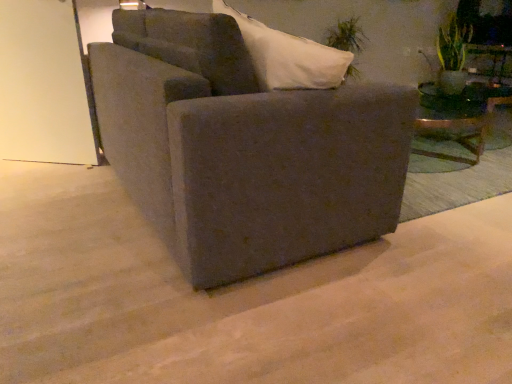
Where is `vacant space that is in between transparent glass door at upper left and matte gray couch at center`? The width and height of the screenshot is (512, 384). vacant space that is in between transparent glass door at upper left and matte gray couch at center is located at coordinates (91, 201).